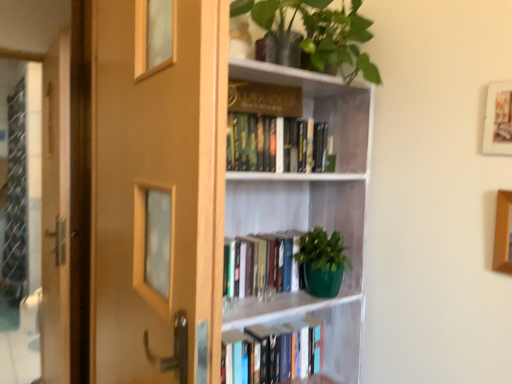
Image resolution: width=512 pixels, height=384 pixels. What are the coordinates of `free spot above hardcover books at upper center, which is the 3th book in bottom-to-top order (from a real-world perspective)` in the screenshot? It's located at (268, 105).